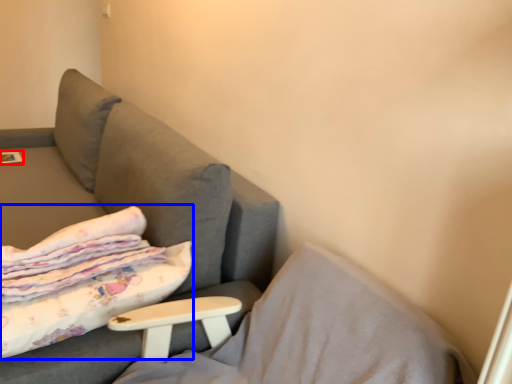
Question: Which of the following is the farthest to the observer, magazine (highlighted by a red box) or bed (highlighted by a blue box)?

Choices:
 (A) magazine
 (B) bed

Answer: (A)